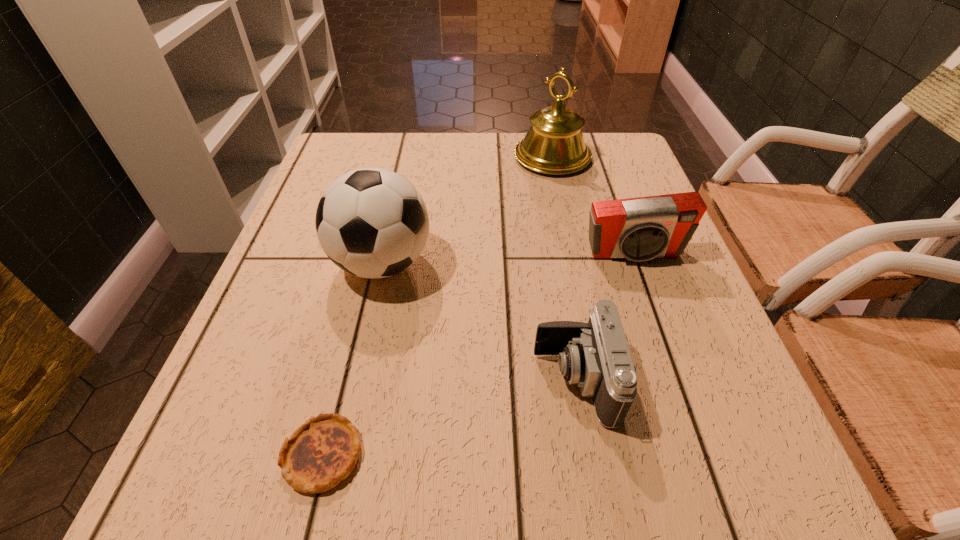
This screenshot has width=960, height=540. I want to click on vacant area that lies between the quiche and the left camera, so click(x=449, y=417).

Locate an element on the screen. The height and width of the screenshot is (540, 960). empty location between the bell and the quiche is located at coordinates (438, 306).

Locate an element on the screen. The height and width of the screenshot is (540, 960). vacant area between the shortest object and the soccer ball is located at coordinates (352, 359).

The width and height of the screenshot is (960, 540). I want to click on vacant space that's between the shortest object and the third shortest object, so click(478, 355).

Where is `empty space that is in between the soccer ball and the shortest object`? This screenshot has width=960, height=540. empty space that is in between the soccer ball and the shortest object is located at coordinates (352, 359).

Image resolution: width=960 pixels, height=540 pixels. What are the coordinates of `free spot between the farthest object and the soccer ball` in the screenshot? It's located at point(468,210).

Identify the location of blank region between the quiche and the farthest object. (438, 306).

Where is `object that is the closest to the shortest object`? Image resolution: width=960 pixels, height=540 pixels. object that is the closest to the shortest object is located at coordinates (372, 223).

Where is `object that is the second nearest to the third tallest object`? The image size is (960, 540). object that is the second nearest to the third tallest object is located at coordinates (554, 144).

Where is `free space in the image that satisfies the following two spatial constraints: 1. on the front-facing side of the right camera; 2. at the front of the second shortest object with an open lens cover`? This screenshot has width=960, height=540. free space in the image that satisfies the following two spatial constraints: 1. on the front-facing side of the right camera; 2. at the front of the second shortest object with an open lens cover is located at coordinates (678, 380).